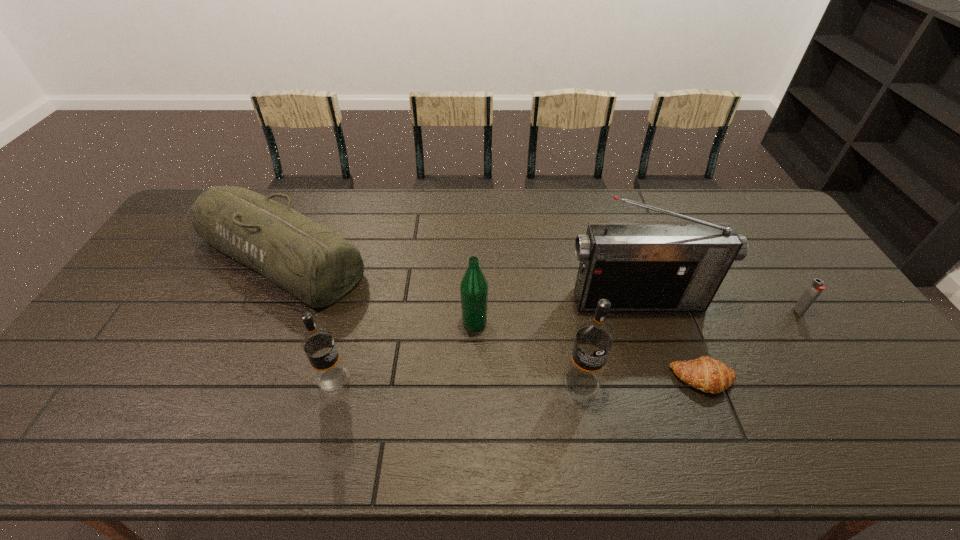
Where is `free space between the taller vodka and the igniter`? The image size is (960, 540). free space between the taller vodka and the igniter is located at coordinates (690, 347).

Where is `free point between the left vodka and the crescent roll`? free point between the left vodka and the crescent roll is located at coordinates (518, 379).

Image resolution: width=960 pixels, height=540 pixels. In order to click on free space between the crescent roll and the duffel bag in this screenshot , I will do `click(492, 318)`.

The image size is (960, 540). What are the coordinates of `vacant space that is in between the tallest object and the shorter vodka` in the screenshot? It's located at (486, 339).

The height and width of the screenshot is (540, 960). I want to click on free space between the radio receiver and the duffel bag, so click(459, 278).

I want to click on vacant region between the fifth tallest object and the crescent roll, so click(x=492, y=318).

Locate which object is the fifth closest to the sixth shortest object. Please provide its 2D coordinates. Your answer should be formatted as a tuple, i.e. [(x, y)], where the tuple contains the x and y coordinates of a point satisfying the conditions above.

[(311, 262)]

Locate an element on the screen. The image size is (960, 540). object that stands as the sixth closest to the third shortest object is located at coordinates (816, 287).

Identify the location of vacant space that satisfies the following two spatial constraints: 1. on the front-facing side of the crescent roll; 2. on the right side of the radio receiver. The width and height of the screenshot is (960, 540). (664, 379).

Find the location of a particular element. vacant space that satisfies the following two spatial constraints: 1. on the front-facing side of the radio receiver; 2. on the right side of the shortest object is located at coordinates (664, 379).